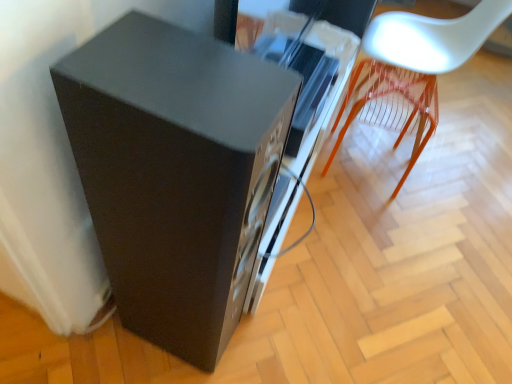
The width and height of the screenshot is (512, 384). Identify the location of empty space that is to the right of matte black speaker at lower left. click(x=269, y=333).